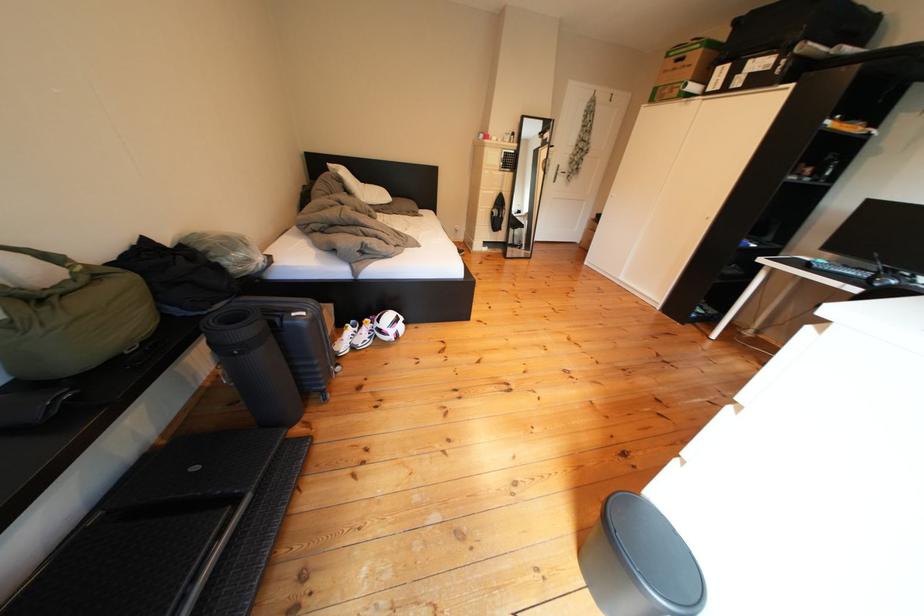
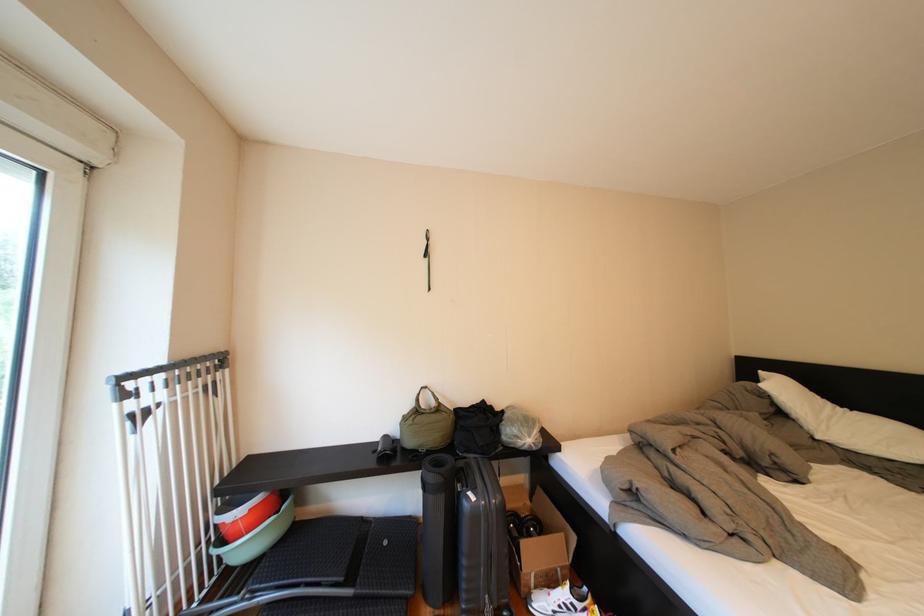
In the second image, find the point that corresponds to point (361, 197) in the first image.

(795, 419)